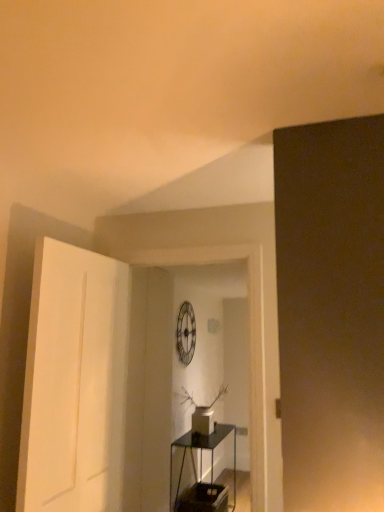
Question: Considering the positions of transparent glass table at center and white matte door at left in the image, is transparent glass table at center taller or shorter than white matte door at left?

Choices:
 (A) short
 (B) tall

Answer: (A)

Question: Is transparent glass table at center to the left or to the right of white matte door at left in the image?

Choices:
 (A) right
 (B) left

Answer: (A)

Question: Is transparent glass table at center in front of or behind white matte door at left in the image?

Choices:
 (A) front
 (B) behind

Answer: (B)

Question: Considering the positions of white matte door at left and transparent glass table at center in the image, is white matte door at left taller or shorter than transparent glass table at center?

Choices:
 (A) short
 (B) tall

Answer: (B)

Question: Would you say white matte door at left is to the left or to the right of transparent glass table at center in the picture?

Choices:
 (A) right
 (B) left

Answer: (B)

Question: Is point (62, 309) closer or farther from the camera than point (216, 441)?

Choices:
 (A) farther
 (B) closer

Answer: (B)

Question: Is white matte door at left wider or thinner than transparent glass table at center?

Choices:
 (A) wide
 (B) thin

Answer: (B)